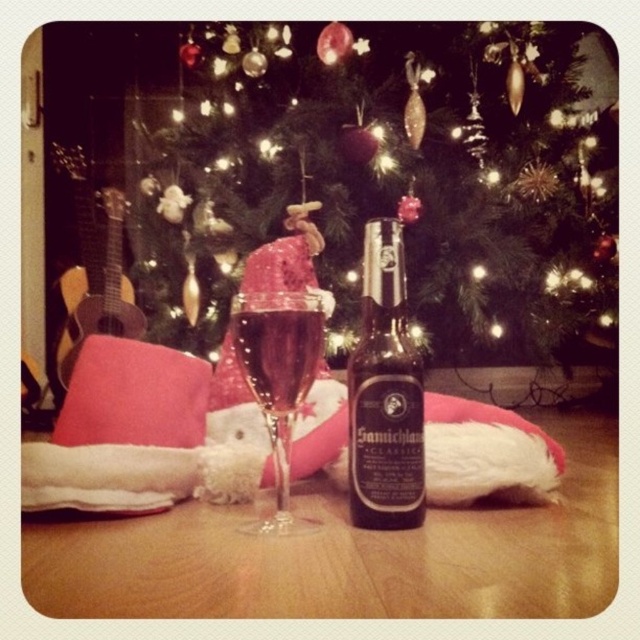
You are a delivery person who needs to place a small gift box on the table. The gift box must be placed exactly at the point with coordinates point (385, 394). However, you notice that this point is on an object on the table. Which object is the point located on?

The point (385, 394) is on the black matte bottle at center.

You are a bartender preparing a drink for a customer. You have a black matte bottle at center and a transparent glass at center in front of you. Which object should you use to pour the drink into the glass?

The transparent glass at center is the one to pour the drink into because the black matte bottle at center is taller than the transparent glass at center, indicating it might be the bottle containing the drink.

Looking at this image, you are planning to pack these items into a narrow box that can only accommodate items with a width of 5 cm or less. Given the black matte bottle at center and the translucent glass at center, which item is more likely to fit in the box based on their widths?

The black matte bottle at center is thinner than the translucent glass at center, so the black matte bottle at center is more likely to fit in the narrow box.